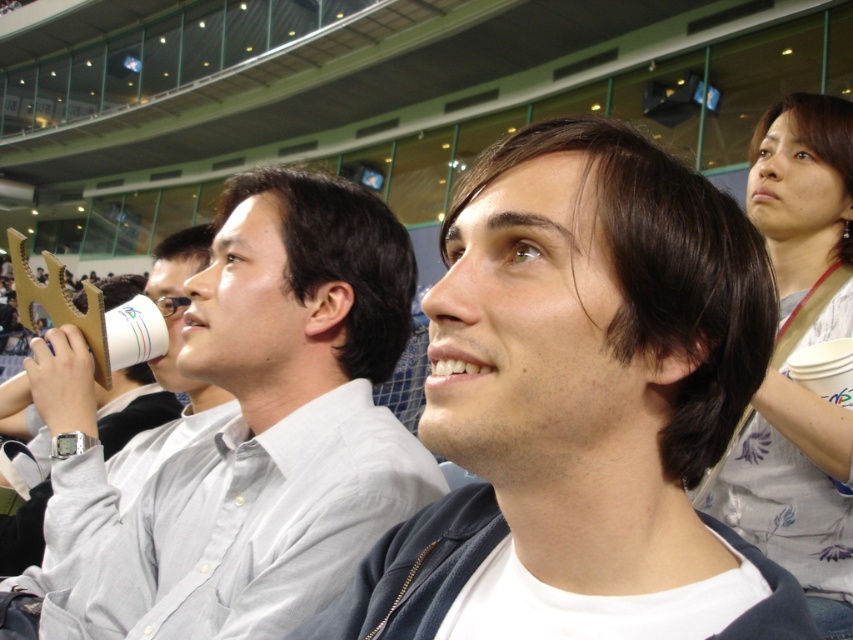
Question: Does matte white shirt at center appear under white paper cup at center?

Choices:
 (A) no
 (B) yes

Answer: (A)

Question: Is matte white shirt at center positioned at the back of white paper cup at center?

Choices:
 (A) yes
 (B) no

Answer: (B)

Question: Considering the relative positions of matte white shirt at center and white paper cup at center in the image provided, where is matte white shirt at center located with respect to white paper cup at center?

Choices:
 (A) right
 (B) left

Answer: (A)

Question: Which object is farther from the camera taking this photo?

Choices:
 (A) white paper cup at center
 (B) matte white shirt at center

Answer: (A)

Question: Which point is closer to the camera taking this photo?

Choices:
 (A) (613, 211)
 (B) (294, 490)

Answer: (A)